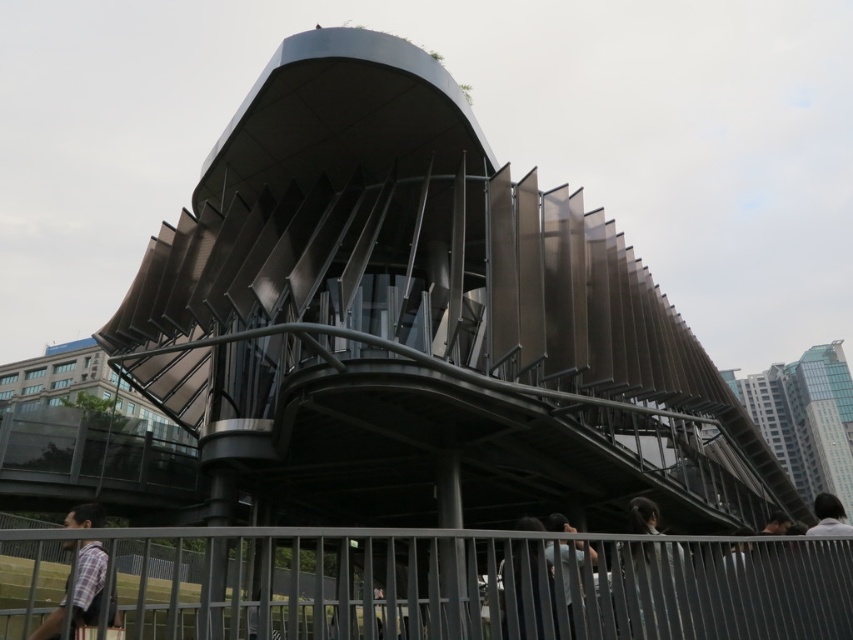
Where is `gray metal fence at lower center`? This screenshot has width=853, height=640. gray metal fence at lower center is located at coordinates (476, 584).

The image size is (853, 640). What do you see at coordinates (476, 584) in the screenshot? I see `gray metal fence at lower center` at bounding box center [476, 584].

Is point (4, 620) positioned in front of point (577, 560)?

That is False.

The width and height of the screenshot is (853, 640). I want to click on gray metal fence at lower center, so click(476, 584).

Does plaid shirt at lower left appear under dark gray fabric jacket at lower center?

No.

Does plaid shirt at lower left have a greater width compared to dark gray fabric jacket at lower center?

Indeed, plaid shirt at lower left has a greater width compared to dark gray fabric jacket at lower center.

Between point (86, 621) and point (537, 612), which one is positioned in front?

Positioned in front is point (86, 621).

This screenshot has height=640, width=853. I want to click on plaid shirt at lower left, so click(86, 584).

Which of these two, glassy steel skyscraper at right or light blue shirt at lower center, stands taller?

Standing taller between the two is glassy steel skyscraper at right.

Based on the photo, is glassy steel skyscraper at right below light blue shirt at lower center?

Correct, glassy steel skyscraper at right is located below light blue shirt at lower center.

Who is more distant from viewer, (775, 432) or (567, 561)?

The point (775, 432) is behind.

Find the location of a particular element. The width and height of the screenshot is (853, 640). glassy steel skyscraper at right is located at coordinates (805, 419).